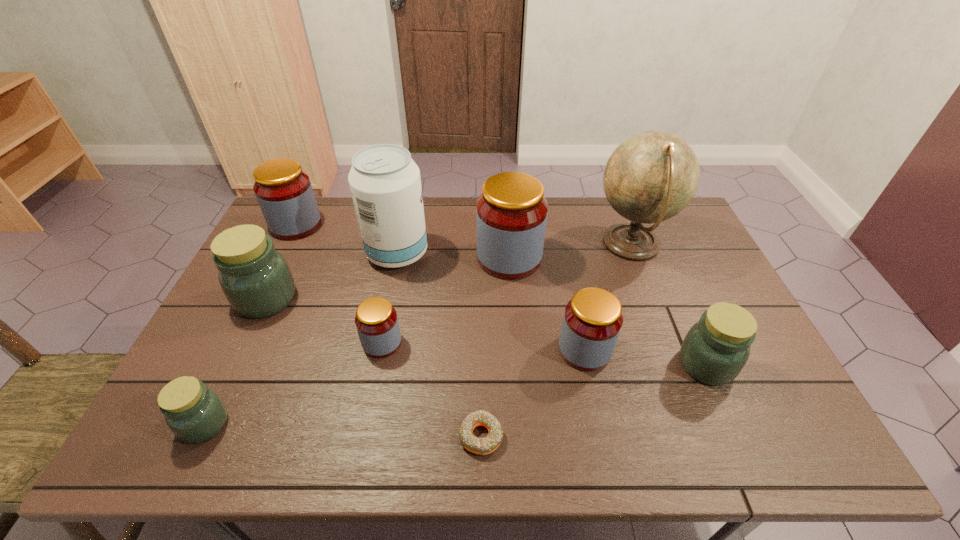
Choose which object is the seventh nearest neighbor to the second red jar from right to left. Please provide its 2D coordinates. Your answer should be formatted as a tuple, i.e. [(x, y)], where the tuple contains the x and y coordinates of a point satisfying the conditions above.

[(255, 278)]

Where is `the seventh closest object to the fifth jar from left to right`? This screenshot has width=960, height=540. the seventh closest object to the fifth jar from left to right is located at coordinates (255, 278).

At what (x,y) coordinates should I click in order to perform the action: click on jar that is the third closest to the alcohol. Please return your answer as a coordinate pair (x, y). The image size is (960, 540). Looking at the image, I should click on (284, 192).

Where is `jar that can be found as the fourth closest to the chocolate doughnut`? The image size is (960, 540). jar that can be found as the fourth closest to the chocolate doughnut is located at coordinates (716, 348).

Where is `red jar that is the second closest to the second biggest green jar`? Image resolution: width=960 pixels, height=540 pixels. red jar that is the second closest to the second biggest green jar is located at coordinates (511, 216).

Point out which red jar is positioned as the second nearest to the farthest green jar. Please provide its 2D coordinates. Your answer should be formatted as a tuple, i.e. [(x, y)], where the tuple contains the x and y coordinates of a point satisfying the conditions above.

[(376, 320)]

Locate an element on the screen. the third closest green jar to the alcohol is located at coordinates [716, 348].

Select which green jar appears as the third closest to the biggest red jar. Please provide its 2D coordinates. Your answer should be formatted as a tuple, i.e. [(x, y)], where the tuple contains the x and y coordinates of a point satisfying the conditions above.

[(194, 413)]

Find the location of `vacant region that satisfies the following two spatial constraints: 1. on the back side of the farthest green jar; 2. on the left side of the third jar from right to left`. vacant region that satisfies the following two spatial constraints: 1. on the back side of the farthest green jar; 2. on the left side of the third jar from right to left is located at coordinates (286, 258).

Locate an element on the screen. This screenshot has width=960, height=540. free point that satisfies the following two spatial constraints: 1. on the front-facing side of the globe; 2. on the front side of the alcohol is located at coordinates (635, 254).